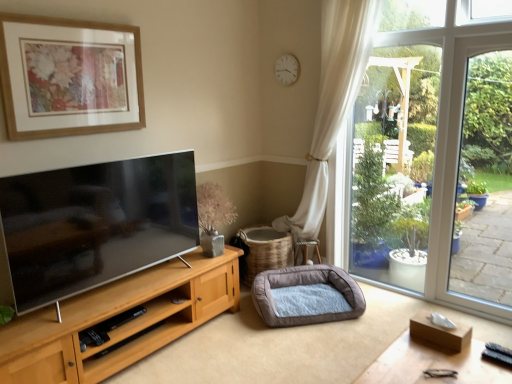
Question: Is beige woven basket at center not inside soft gray fabric dog bed at lower center?

Choices:
 (A) no
 (B) yes

Answer: (B)

Question: Can you confirm if beige woven basket at center is thinner than soft gray fabric dog bed at lower center?

Choices:
 (A) no
 (B) yes

Answer: (B)

Question: From the image's perspective, is beige woven basket at center over soft gray fabric dog bed at lower center?

Choices:
 (A) no
 (B) yes

Answer: (B)

Question: Considering the relative positions of beige woven basket at center and soft gray fabric dog bed at lower center in the image provided, is beige woven basket at center to the left of soft gray fabric dog bed at lower center from the viewer's perspective?

Choices:
 (A) no
 (B) yes

Answer: (B)

Question: Is beige woven basket at center positioned far away from soft gray fabric dog bed at lower center?

Choices:
 (A) no
 (B) yes

Answer: (A)

Question: From a real-world perspective, relative to wooden picture frame at upper left, is white plastic clock at upper center vertically above or below?

Choices:
 (A) above
 (B) below

Answer: (A)

Question: Is white plastic clock at upper center taller or shorter than wooden picture frame at upper left?

Choices:
 (A) tall
 (B) short

Answer: (B)

Question: Considering the positions of white plastic clock at upper center and wooden picture frame at upper left in the image, is white plastic clock at upper center bigger or smaller than wooden picture frame at upper left?

Choices:
 (A) big
 (B) small

Answer: (B)

Question: Is white plastic clock at upper center wider or thinner than wooden picture frame at upper left?

Choices:
 (A) wide
 (B) thin

Answer: (B)

Question: Looking at their shapes, would you say soft gray fabric dog bed at lower center is wider or thinner than wooden picture frame at upper left?

Choices:
 (A) thin
 (B) wide

Answer: (B)

Question: Relative to wooden picture frame at upper left, is soft gray fabric dog bed at lower center in front or behind?

Choices:
 (A) behind
 (B) front

Answer: (A)

Question: Considering the positions of soft gray fabric dog bed at lower center and wooden picture frame at upper left in the image, is soft gray fabric dog bed at lower center taller or shorter than wooden picture frame at upper left?

Choices:
 (A) tall
 (B) short

Answer: (B)

Question: Would you say soft gray fabric dog bed at lower center is inside or outside wooden picture frame at upper left?

Choices:
 (A) inside
 (B) outside

Answer: (B)

Question: In terms of height, does beige woven basket at center look taller or shorter compared to soft gray fabric dog bed at lower center?

Choices:
 (A) tall
 (B) short

Answer: (A)

Question: From a real-world perspective, relative to soft gray fabric dog bed at lower center, is beige woven basket at center vertically above or below?

Choices:
 (A) above
 (B) below

Answer: (A)